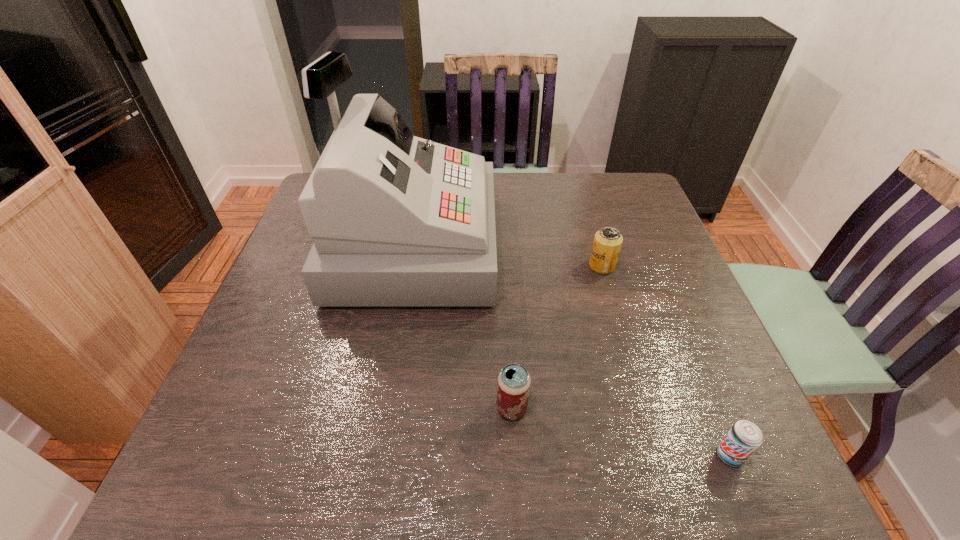
Image resolution: width=960 pixels, height=540 pixels. Identify the location of free point between the second beer can from left to right and the shortest beer can. (665, 361).

Identify which object is the second closest to the tallest object. Please provide its 2D coordinates. Your answer should be formatted as a tuple, i.e. [(x, y)], where the tuple contains the x and y coordinates of a point satisfying the conditions above.

[(607, 243)]

Locate which object ranks third in proximity to the second object from right to left. Please provide its 2D coordinates. Your answer should be formatted as a tuple, i.e. [(x, y)], where the tuple contains the x and y coordinates of a point satisfying the conditions above.

[(744, 437)]

Locate an element on the screen. beer can that stands as the closest to the farthest beer can is located at coordinates (513, 386).

Choose which beer can is the second nearest neighbor to the third object from left to right. Please provide its 2D coordinates. Your answer should be formatted as a tuple, i.e. [(x, y)], where the tuple contains the x and y coordinates of a point satisfying the conditions above.

[(744, 437)]

Identify the location of vacant space that satisfies the following two spatial constraints: 1. on the keypad side of the nearest object; 2. on the right side of the cash register. The image size is (960, 540). (376, 455).

Identify the location of vacant space that satisfies the following two spatial constraints: 1. on the keypad side of the rightmost object; 2. on the right side of the tallest object. Image resolution: width=960 pixels, height=540 pixels. (376, 455).

Locate an element on the screen. vacant space that satisfies the following two spatial constraints: 1. on the keypad side of the tallest object; 2. on the left side of the nearest object is located at coordinates (376, 455).

This screenshot has width=960, height=540. Find the location of `free space that satisfies the following two spatial constraints: 1. on the keypad side of the shortest beer can; 2. on the left side of the cash register`. free space that satisfies the following two spatial constraints: 1. on the keypad side of the shortest beer can; 2. on the left side of the cash register is located at coordinates (376, 455).

Find the location of `vacant space that satisfies the following two spatial constraints: 1. on the back side of the second nearest beer can; 2. on the keypad side of the tallest object`. vacant space that satisfies the following two spatial constraints: 1. on the back side of the second nearest beer can; 2. on the keypad side of the tallest object is located at coordinates (502, 246).